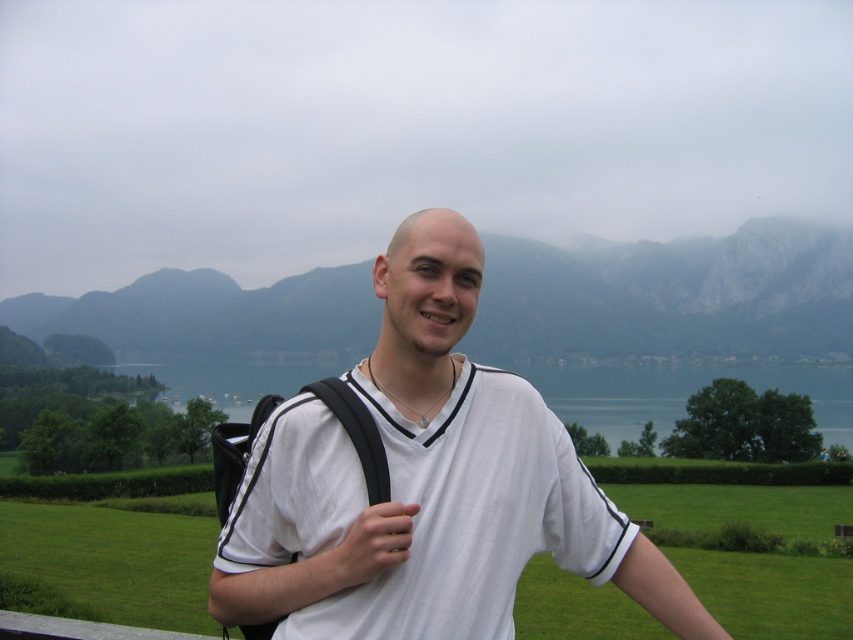
You are planning to take a photo of the green rocky mountain at upper center and the green water at center. Since you want both to be clearly visible in the frame, which object should you focus on to ensure proper depth of field?

The green rocky mountain at upper center has a larger width than the green water at center, so focusing on the mountain will help ensure both are in focus due to its greater size and distance from the camera.

Based on the photo, you are a photographer taking a picture of the green rocky mountain at upper center and the green water at center. Which object is located to the right of the other?

The green rocky mountain at upper center is positioned on the right side of green water at center.